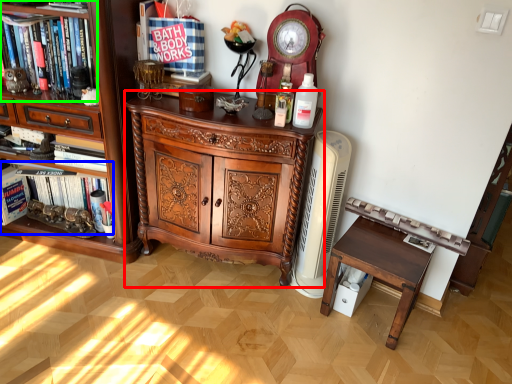
Question: Considering the real-world distances, which object is closest to chest of drawers (highlighted by a red box)? book (highlighted by a blue box) or shelf (highlighted by a green box).

Choices:
 (A) book
 (B) shelf

Answer: (A)